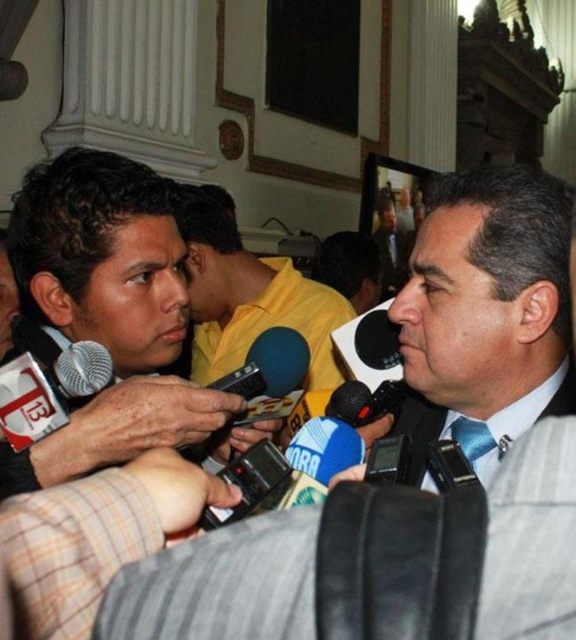
Question: Can you confirm if matte black microphone at left is wider than yellow matte shirt at center?

Choices:
 (A) yes
 (B) no

Answer: (B)

Question: Does matte black camera at center have a larger size compared to yellow matte shirt at center?

Choices:
 (A) no
 (B) yes

Answer: (A)

Question: Among these objects, which one is farthest from the camera?

Choices:
 (A) yellow matte shirt at center
 (B) matte black camera at center
 (C) matte black microphone at left

Answer: (A)

Question: Considering the relative positions of matte black camera at center and silver metallic microphone at center in the image provided, where is matte black camera at center located with respect to silver metallic microphone at center?

Choices:
 (A) above
 (B) below

Answer: (B)

Question: Which point is farther from the camera taking this photo?

Choices:
 (A) (263, 440)
 (B) (118, 365)
 (C) (66, 385)

Answer: (B)

Question: Which of the following is the farthest from the observer?

Choices:
 (A) (173, 282)
 (B) (237, 464)
 (C) (452, 365)

Answer: (A)